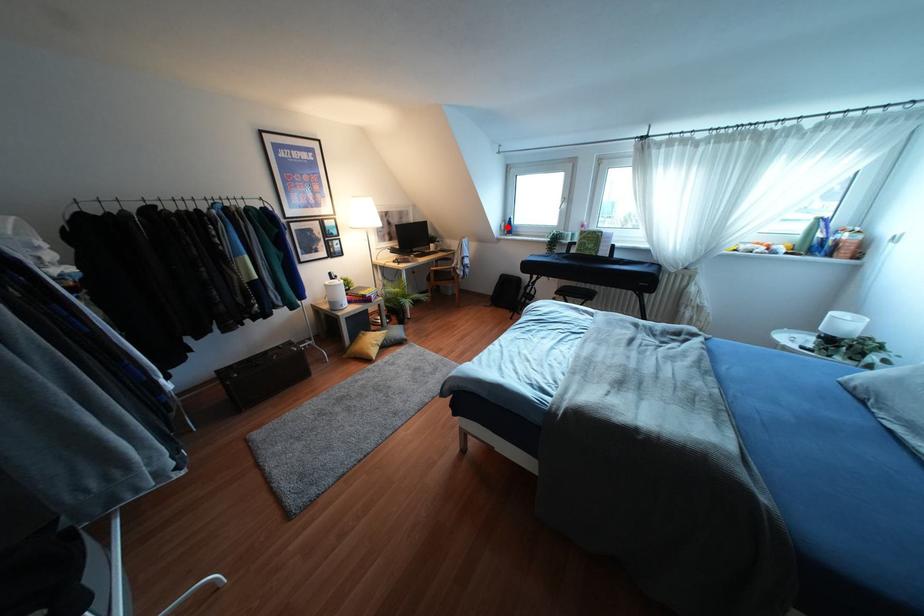
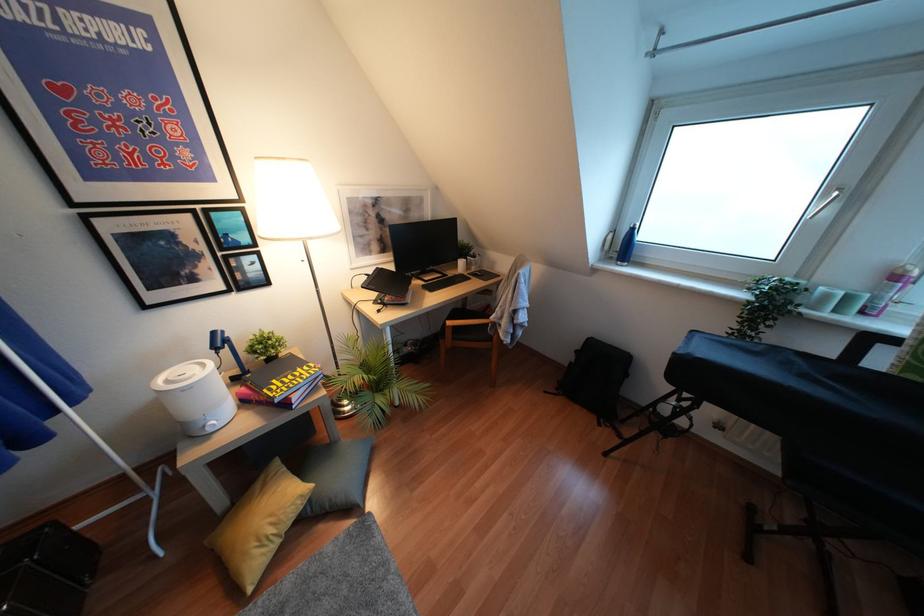
Question: I am providing you with two images of the same scene from different viewpoints. Image1 has a red point marked. In image2, the corresponding 3D location appears at what relative position? Reply with the corresponding letter.

Choices:
 (A) Closer
 (B) Farther

Answer: (B)